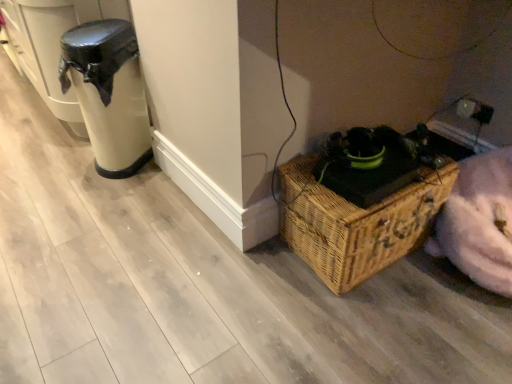
This screenshot has height=384, width=512. In order to click on vacant area that is in front of matte black trash can at left in this screenshot , I will do `click(114, 192)`.